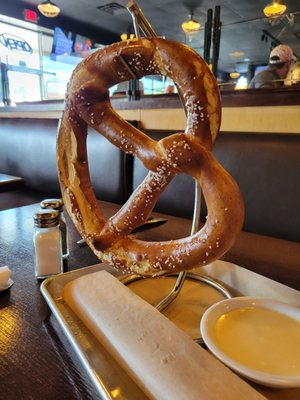
The width and height of the screenshot is (300, 400). I want to click on sauce dish, so click(x=260, y=303).